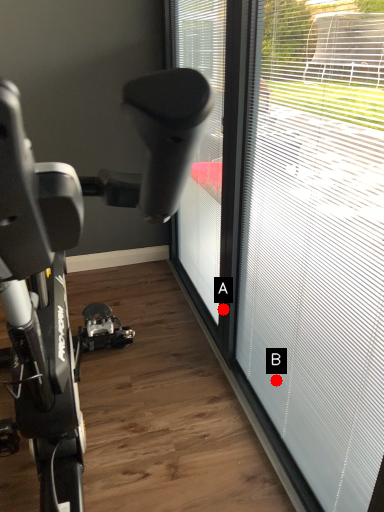
Question: Two points are circled on the image, labeled by A and B beside each circle. Among these points, which one is nearest to the camera?

Choices:
 (A) A is closer
 (B) B is closer

Answer: (B)